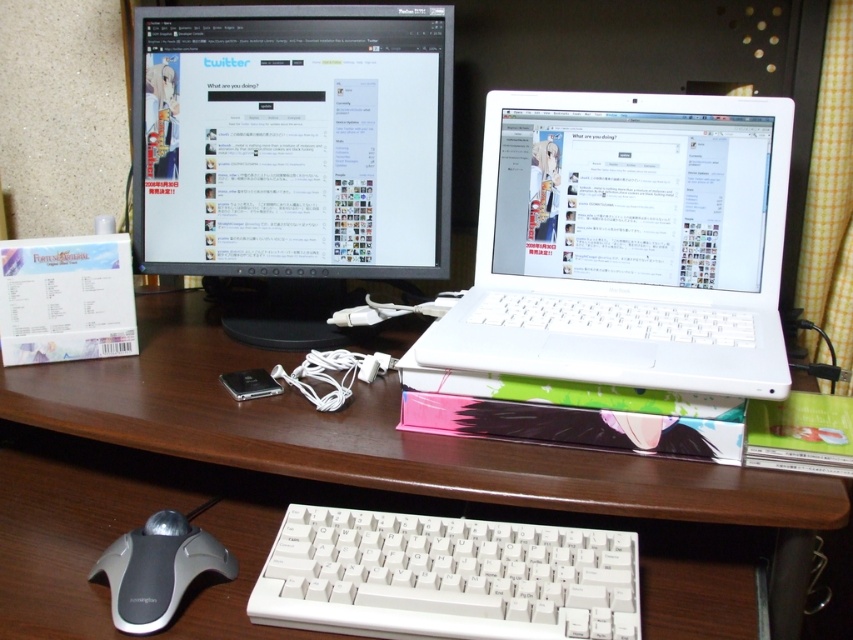
Question: Which point is farther to the camera?

Choices:
 (A) (221, 333)
 (B) (399, 563)
 (C) (479, 321)

Answer: (A)

Question: Does white plastic laptop at center appear on the right side of white wood computer desk at center?

Choices:
 (A) yes
 (B) no

Answer: (A)

Question: Based on their relative distances, which object is farther from the gray rubberized mouse at lower left?

Choices:
 (A) matte black monitor at upper left
 (B) white plastic laptop at center
 (C) white plastic keyboard at center

Answer: (B)

Question: Can you confirm if white wood computer desk at center is positioned above white plastic keyboard at center?

Choices:
 (A) no
 (B) yes

Answer: (B)

Question: Which point is farther from the camera taking this photo?

Choices:
 (A) (479, 218)
 (B) (135, 536)

Answer: (A)

Question: Does white plastic keyboard at center have a lesser width compared to gray rubberized mouse at lower left?

Choices:
 (A) yes
 (B) no

Answer: (B)